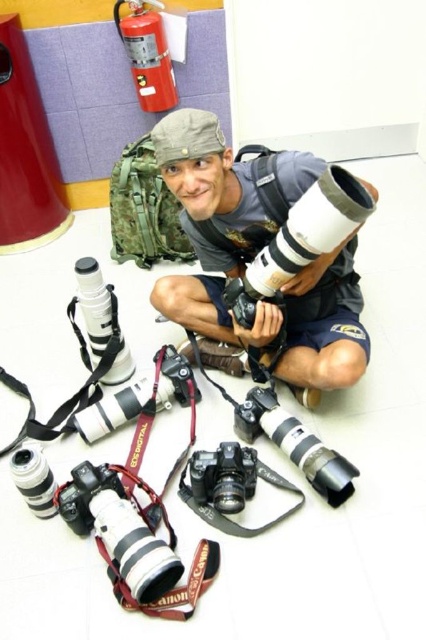
You are a photographer trying to organize your equipment. You have two matte black cameras. One is at the center and the other at the lower left. Based on the scene description, where is the matte black camera at center in relation to the matte black camera at lower left?

The matte black camera at center is located above the matte black camera at lower left.

You are taking a photo of the photographer in the scene. You want to focus on the point that is closer to the camera. Which point should you choose between point (118, 493) and point (232, 500)?

You should choose point (232, 500) because it is closer to the camera than point (118, 493).

You are a photographer trying to choose between two cameras for a photo shoot. You have the matte black camera at lower left and the black plastic camera at center. Which camera is bigger?

The matte black camera at lower left is larger in size compared to the black plastic camera at center.